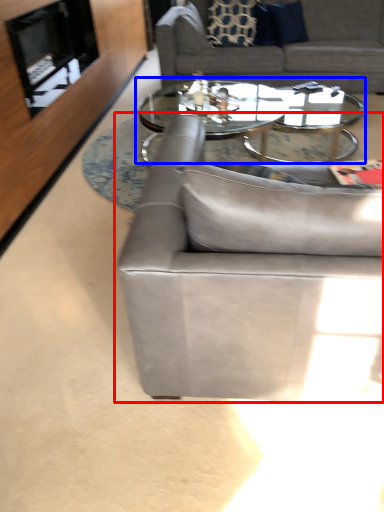
Question: Which object appears farthest to the camera in this image, studio couch (highlighted by a red box) or coffee table (highlighted by a blue box)?

Choices:
 (A) studio couch
 (B) coffee table

Answer: (B)